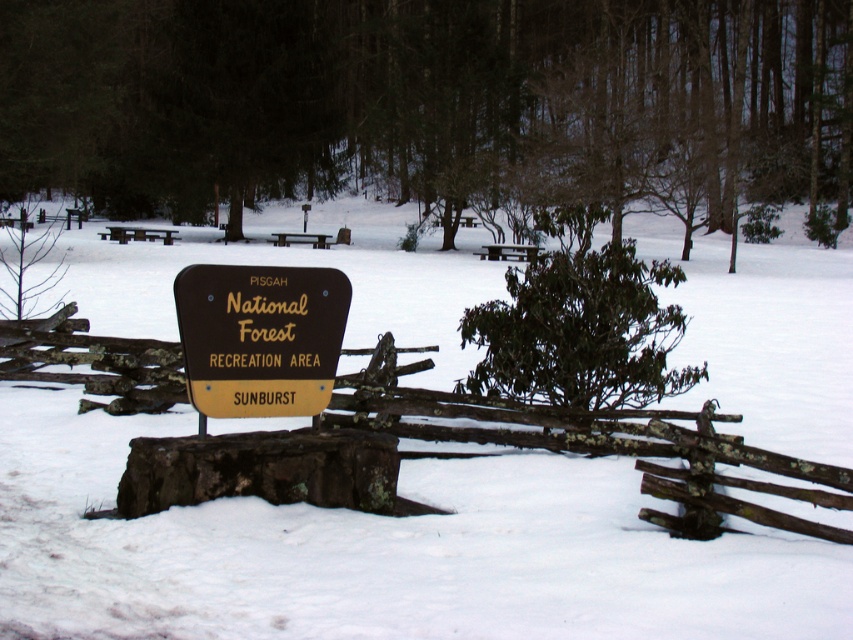
You are planning to take a photo of the green leafy tree at center and the green leafy bush at center in the winter scene. Which object should you focus on first if you want to capture both in the frame without moving the camera?

You should focus on the green leafy tree at center first because it is wider than the green leafy bush at center, ensuring it fits properly in the frame.

You are standing at the wooden signpost on the tree stump and want to walk towards the picnic tables in the background. Which point, point (x=712, y=6) or point (x=637, y=300), is closer to the picnic tables?

Point (x=712, y=6) is behind point (x=637, y=300), so point (x=712, y=6) is closer to the picnic tables.